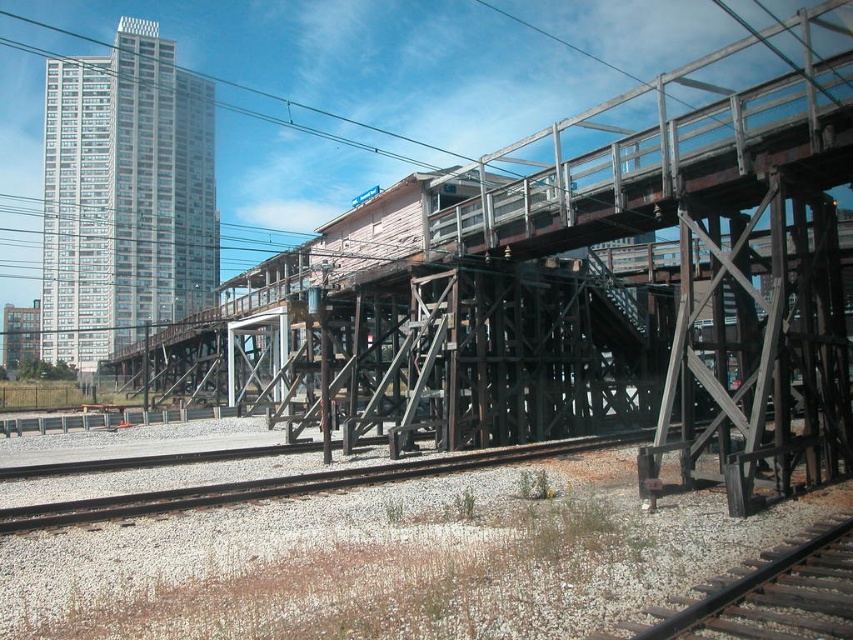
This screenshot has height=640, width=853. What do you see at coordinates (608, 240) in the screenshot? I see `wooden bridge at center` at bounding box center [608, 240].

How far apart are wooden bridge at center and black wire at upper center?

wooden bridge at center and black wire at upper center are 103.35 meters apart.

Is point (314, 340) behind point (57, 29)?

That is False.

Where is `wooden bridge at center`? wooden bridge at center is located at coordinates (608, 240).

Who is more distant from viewer, (x=738, y=600) or (x=256, y=90)?

Point (x=256, y=90)

Describe the element at coordinates (775, 595) in the screenshot. I see `brown wooden train track at lower right` at that location.

At what (x,y) coordinates should I click in order to perform the action: click on brown wooden train track at lower right. Please return your answer as a coordinate pair (x, y). Image resolution: width=853 pixels, height=640 pixels. Looking at the image, I should click on (775, 595).

Does wooden bridge at center appear under brown wooden train track at lower right?

No.

Is point (720, 218) farther from viewer compared to point (846, 518)?

Yes, point (720, 218) is behind point (846, 518).

This screenshot has height=640, width=853. What are the coordinates of `wooden bridge at center` in the screenshot? It's located at (608, 240).